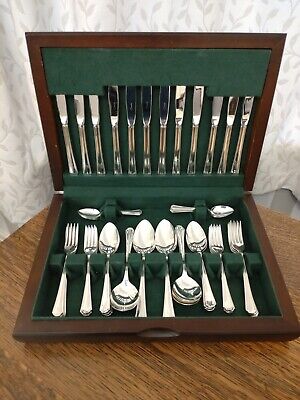
At what (x,y) coordinates should I click in order to perform the action: click on forks. Please return your answer as a coordinate pair (x, y). This screenshot has height=400, width=300. Looking at the image, I should click on (70, 244), (87, 244), (218, 235), (238, 235).